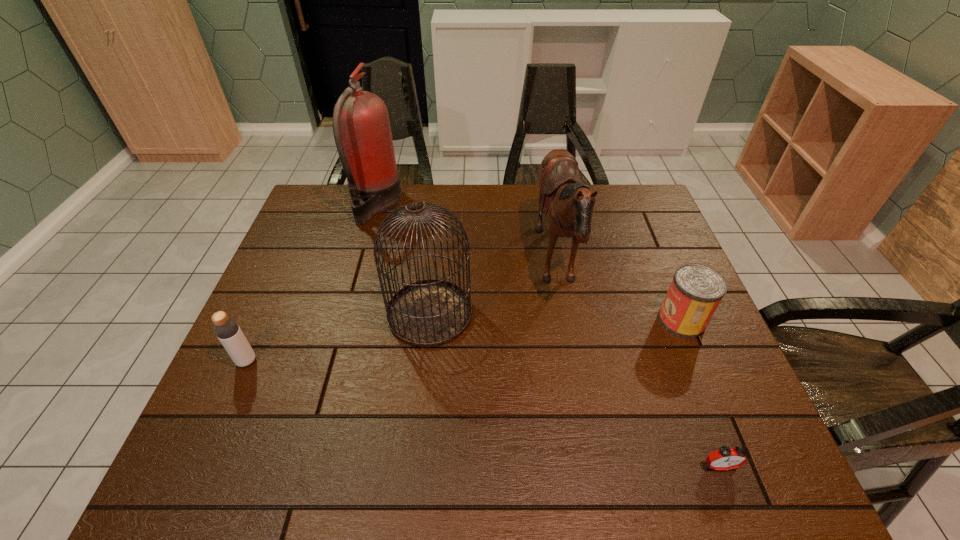
Find the location of a particular element. This screenshot has height=540, width=960. free point that satisfies the following two spatial constraints: 1. on the back side of the can; 2. on the right side of the second nearest object is located at coordinates (265, 320).

Image resolution: width=960 pixels, height=540 pixels. Identify the location of vacant space that satisfies the following two spatial constraints: 1. on the back side of the birdcage; 2. at the nozzle of the second object from left to right. (441, 205).

You are a GUI agent. You are given a task and a screenshot of the screen. Output one action in this format:
    pyautogui.click(x=<x>, y=<y>)
    Task: Click on the blank area in the image that satisfies the following two spatial constraints: 1. at the nozzle of the can; 2. on the left side of the fire extinguisher
    The width and height of the screenshot is (960, 540).
    Given the screenshot: What is the action you would take?
    pyautogui.click(x=343, y=320)